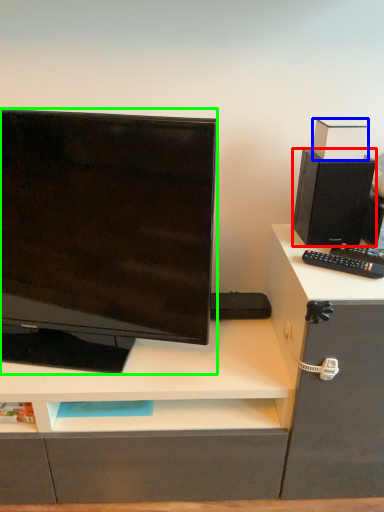
Question: Which object is positioned closest to speaker (highlighted by a red box)? Select from box (highlighted by a blue box) and computer monitor (highlighted by a green box).

Choices:
 (A) box
 (B) computer monitor

Answer: (A)